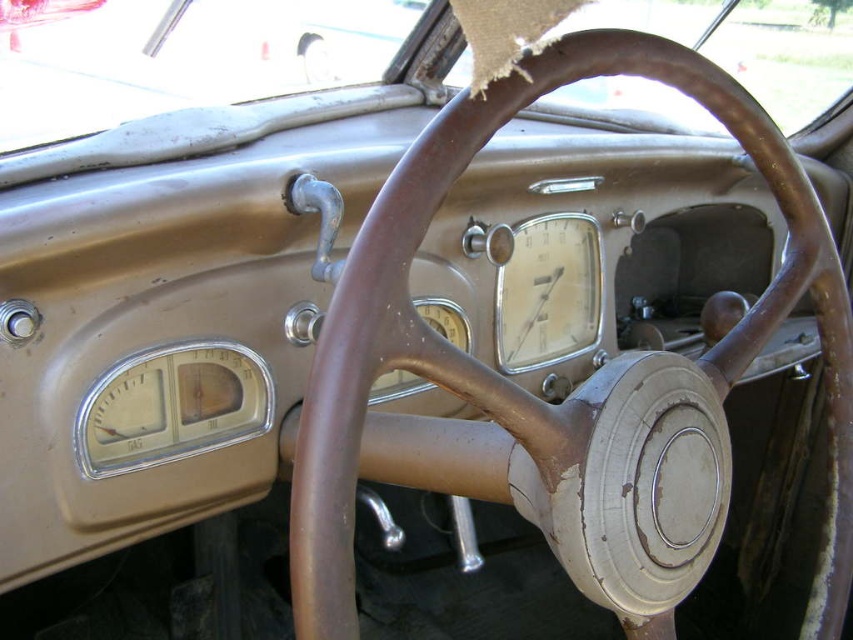
Looking at this image, you are sitting in the driver seat of the old vehicle and need to check the speedometer. Since the brown leather steering wheel at center is in your way, can you easily see the metallic silver speedometer at center without moving the steering wheel?

The metallic silver speedometer at center is to the right of the brown leather steering wheel at center, so you can easily see it without moving the steering wheel because it is positioned to the side of the steering wheel.

You are a mechanic working on an old car. You need to reach both the metallic silver speedometer at center and the fuel gauge on the left side. The tools you have are 3 feet long. Can you safely reach both instruments with your tools without moving your position?

The metallic silver speedometer at center and the fuel gauge on the left side are 3.33 feet apart. Since your tools are only 3 feet long, you cannot safely reach both instruments without moving your position because the distance between them exceeds the tool length.

You are a mechanic working on an old car and need to locate the metallic silver speedometer at center. According to the image, what are the coordinates of its position?

The metallic silver speedometer at center is located at coordinates point [548,291].